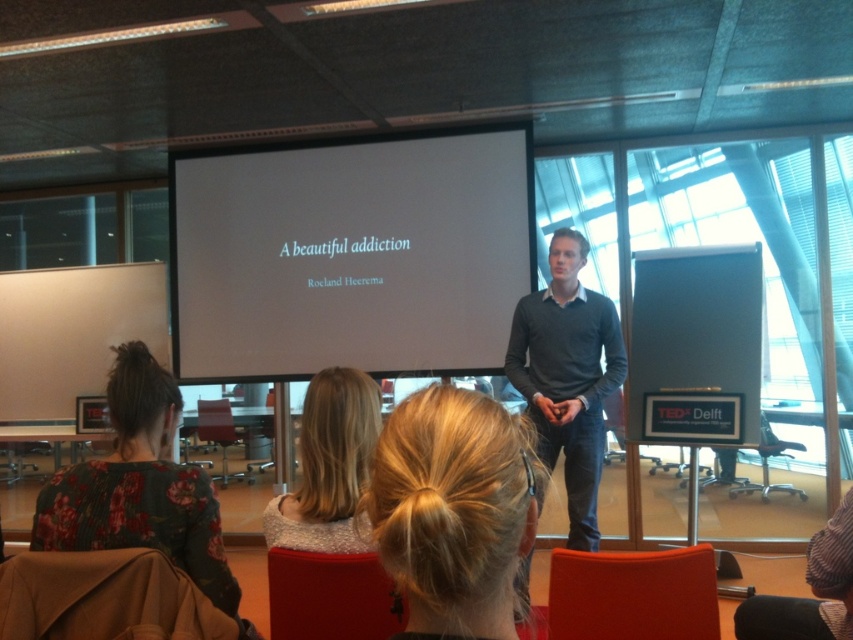
Question: Which point is closer to the camera?

Choices:
 (A) (790, 492)
 (B) (154, 476)
 (C) (508, 305)
 (D) (527, 464)

Answer: (D)

Question: Does matte red chair at lower center have a larger size compared to black plastic chair at center?

Choices:
 (A) no
 (B) yes

Answer: (A)

Question: Can you confirm if brown fabric chair at lower left is positioned to the right of matte red chair at lower center?

Choices:
 (A) no
 (B) yes

Answer: (A)

Question: Is dark gray sweater at center closer to the viewer compared to blonde hair at center?

Choices:
 (A) yes
 (B) no

Answer: (B)

Question: Based on their relative distances, which object is nearer to the dark gray sweater at center?

Choices:
 (A) blonde hair at center
 (B) matte red chair at lower center

Answer: (A)

Question: Which of the following is the closest to the observer?

Choices:
 (A) floral fabric dress at lower left
 (B) metallic silver chair at center

Answer: (A)